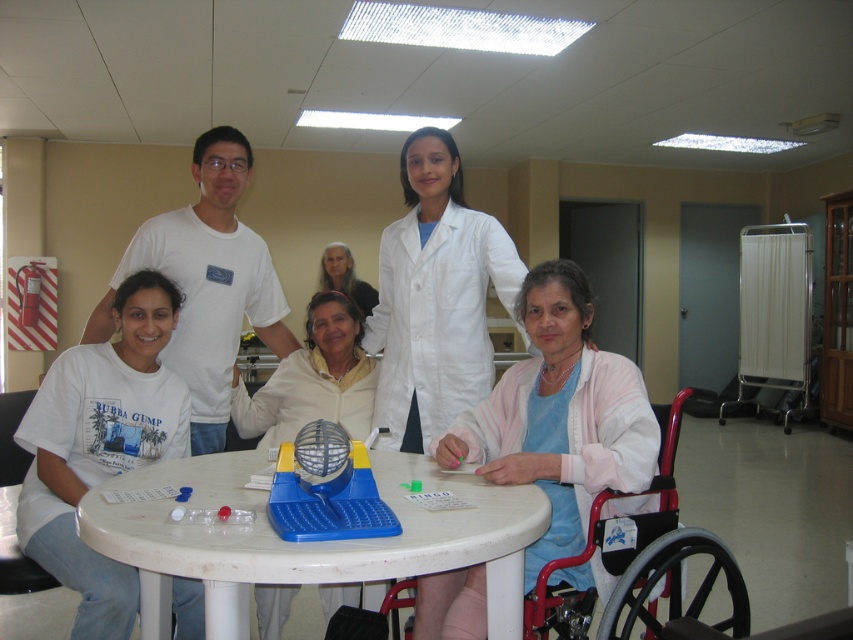
You are a researcher analyzing the image of the rehabilitation session. You need to locate the white cotton shirt at lower left. What are the coordinates where you should focus your analysis?

The white cotton shirt at lower left is located at coordinates point (100, 445).

You are a physical therapist preparing for a group session in the described room. You need to place a new piece of equipment on the table. Given the white plastic table at center and the pink fabric at center, which object should you place the equipment on to ensure it stays on the table?

The equipment should be placed on the white plastic table at center because it is smaller than the pink fabric at center, ensuring stability and proper placement on the table.

In the rehabilitation room scene, you see a white cotton shirt at lower left and a white lab coat at center. Which clothing item is positioned more to the left side of the scene?

The white cotton shirt at lower left is positioned more to the left side of the scene than the white lab coat at center.